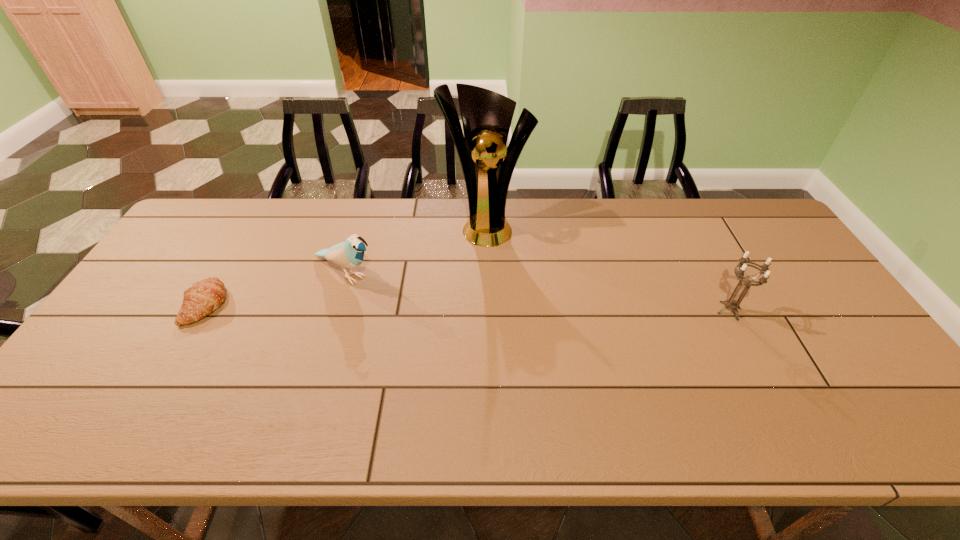
Identify the location of free space on the desktop that is between the shortest object and the rightmost object and is positioned at the face of the bird. (404, 307).

Image resolution: width=960 pixels, height=540 pixels. What are the coordinates of `vacant space on the desktop that is between the leftmost object and the rightmost object and is positioned at the front of the award, where the globe is visible` in the screenshot? It's located at (506, 308).